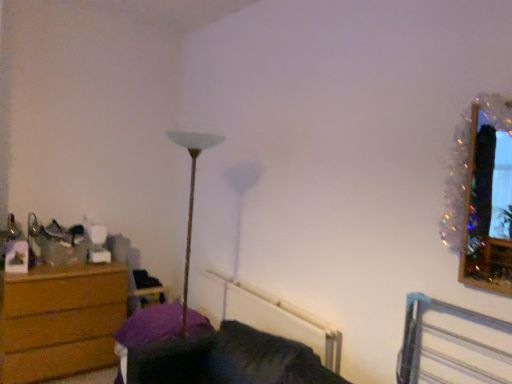
Question: Is wooden swivel chair at left in front of or behind white plastic radiator at lower center in the image?

Choices:
 (A) behind
 (B) front

Answer: (A)

Question: Looking at the image, does wooden swivel chair at left seem bigger or smaller compared to white plastic radiator at lower center?

Choices:
 (A) big
 (B) small

Answer: (B)

Question: Which object is the farthest from the velvet purple couch at lower center?

Choices:
 (A) white plastic radiator at lower center
 (B) wooden swivel chair at left
 (C) metallic silver bed frame at lower right
 (D) wooden chest of drawers at left
 (E) sparkly tinsel picture frame at upper right

Answer: (B)

Question: Estimate the real-world distances between objects in this image. Which object is closer to the velvet purple couch at lower center?

Choices:
 (A) sparkly tinsel picture frame at upper right
 (B) wooden chest of drawers at left
 (C) wooden swivel chair at left
 (D) metallic silver bed frame at lower right
 (E) white plastic radiator at lower center

Answer: (E)